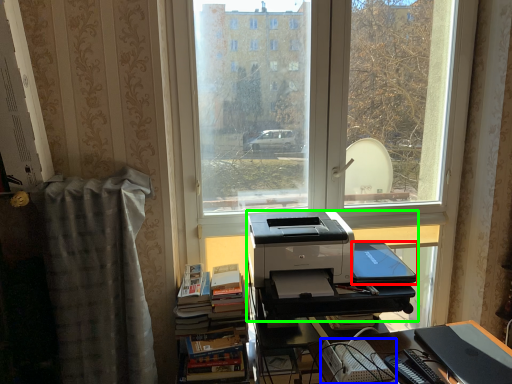
Question: Which object is positioned closest to register (highlighted by a red box)? Select from paperback book (highlighted by a blue box) and printer (highlighted by a green box).

Choices:
 (A) paperback book
 (B) printer

Answer: (B)